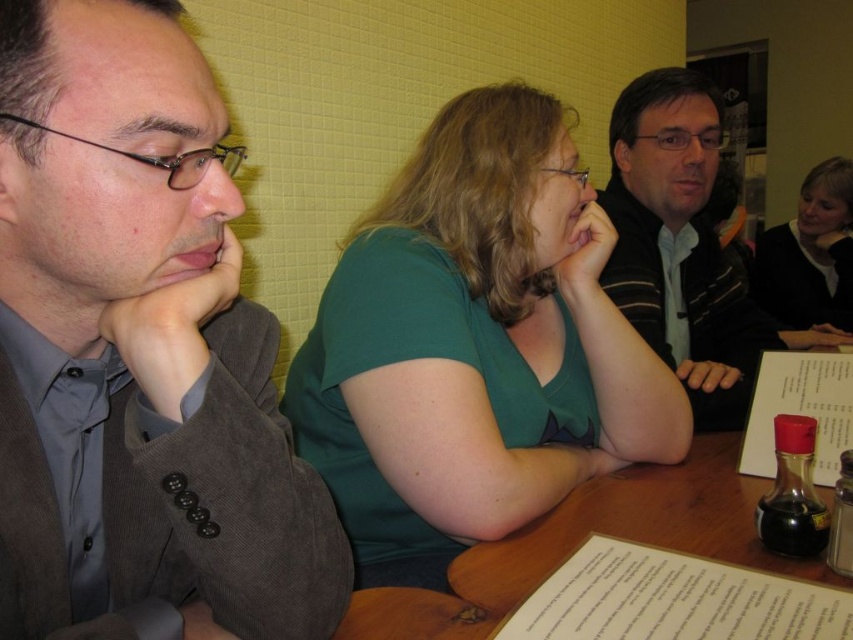
You are a person with a height of 1.7 meters. You are standing at the point marked by the coordinate point at point (x=683, y=467). You want to reach the door located at the opposite side of the room. There is an obstacle 1.2 meters tall placed between you and the door. Can you safely walk around the obstacle without bending down?

The obstacle is 1.2 meters tall, which is shorter than your height of 1.7 meters. Since you can walk around it without needing to bend down, you can safely navigate past the obstacle.

You are a photographer standing at the camera position. You need to adjust the focus so that the green matte shirt at center is in sharp focus. What distance should you set the focus to?

The green matte shirt at center and camera are 33.76 inches apart from each other, so you should set the focus distance to 33.76 inches to ensure the green matte shirt at center is in sharp focus.